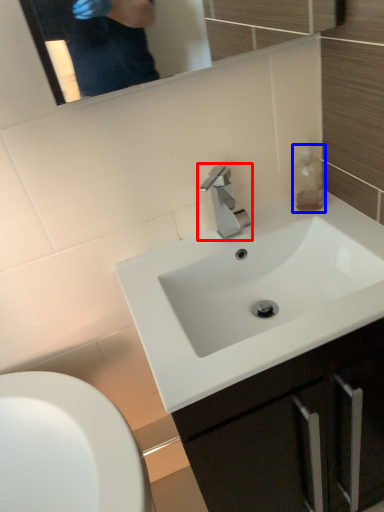
Question: Which point is further to the camera, tap (highlighted by a red box) or bottle (highlighted by a blue box)?

Choices:
 (A) tap
 (B) bottle

Answer: (B)